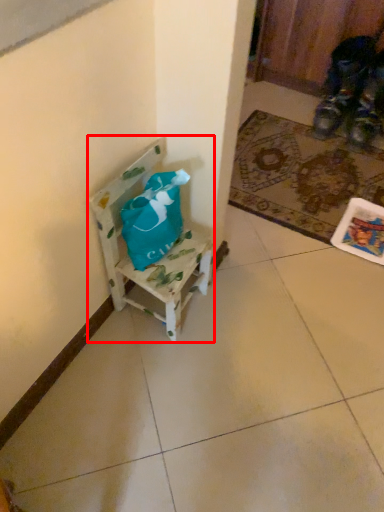
Question: From the image's perspective, considering the relative positions of chair (annotated by the red box) and mat in the image provided, where is chair (annotated by the red box) located with respect to the staircase?

Choices:
 (A) below
 (B) above

Answer: (A)